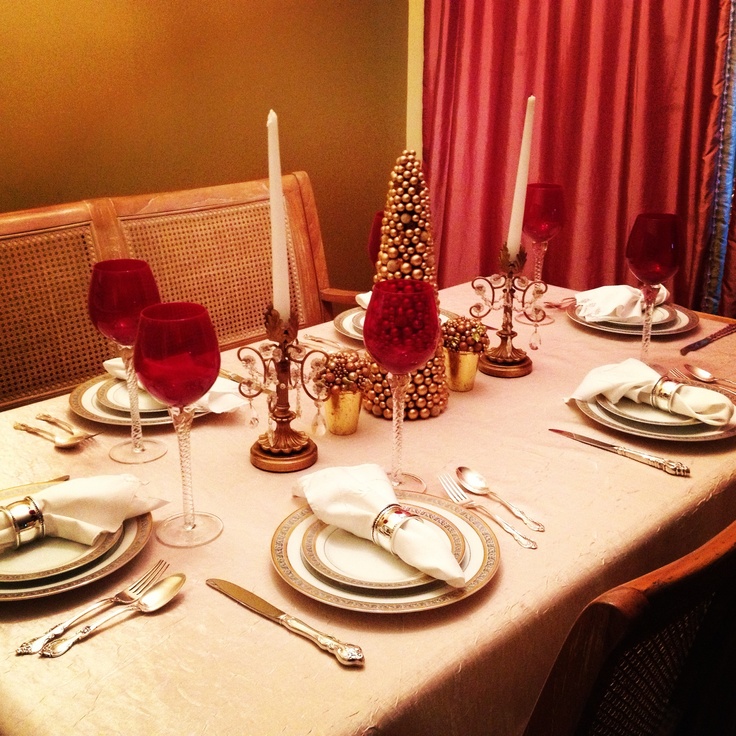
At what (x,y) coordinates should I click in order to perform the action: click on knives. Please return your answer as a coordinate pair (x, y). Looking at the image, I should click on (318, 631), (634, 452), (701, 343), (450, 310), (227, 371), (56, 475).